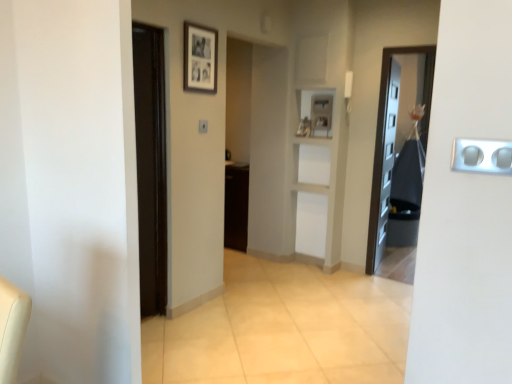
Question: From a real-world perspective, is black fabric bag at right positioned above or below white plastic light switch at center?

Choices:
 (A) above
 (B) below

Answer: (B)

Question: From the image's perspective, is black fabric bag at right positioned above or below white plastic light switch at center?

Choices:
 (A) below
 (B) above

Answer: (A)

Question: Which of these objects is positioned closest to the silver metallic outlet at right?

Choices:
 (A) black matte picture frame at upper center
 (B) black fabric bag at right
 (C) white plastic light switch at center

Answer: (A)

Question: Estimate the real-world distances between objects in this image. Which object is closer to the black fabric bag at right?

Choices:
 (A) black matte picture frame at upper center
 (B) white plastic light switch at center
 (C) silver metallic outlet at right

Answer: (A)